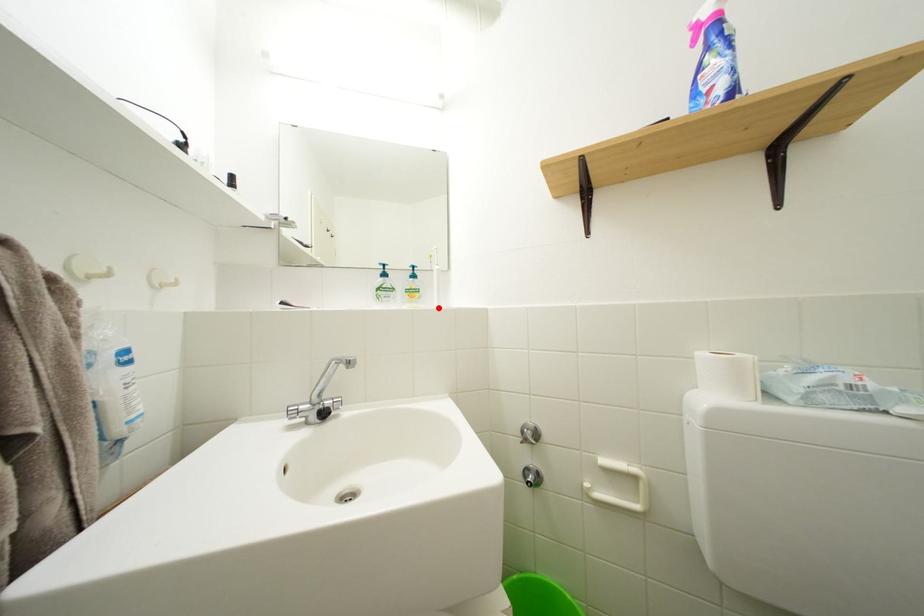
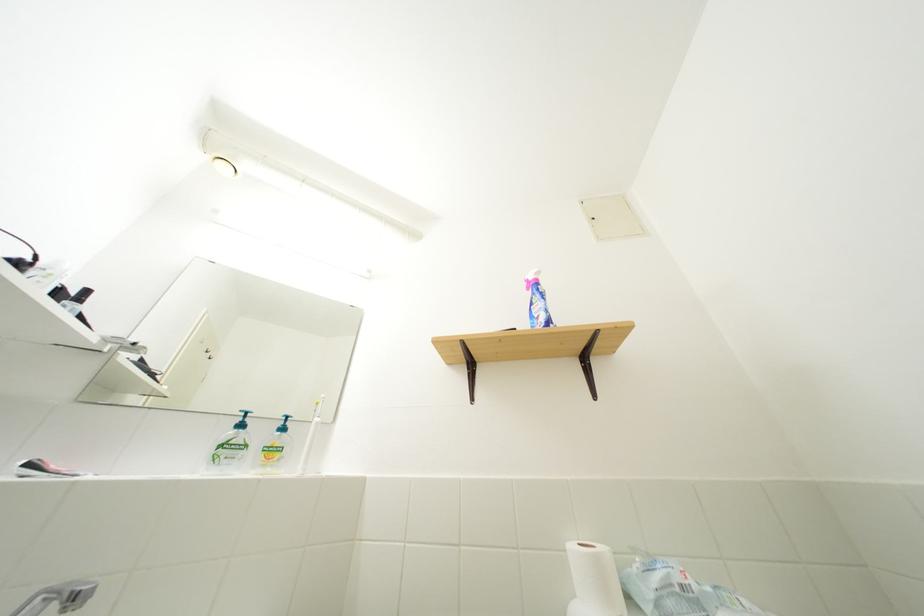
Where in the second image is the point corresponding to the highlighted location from the first image?

(298, 474)